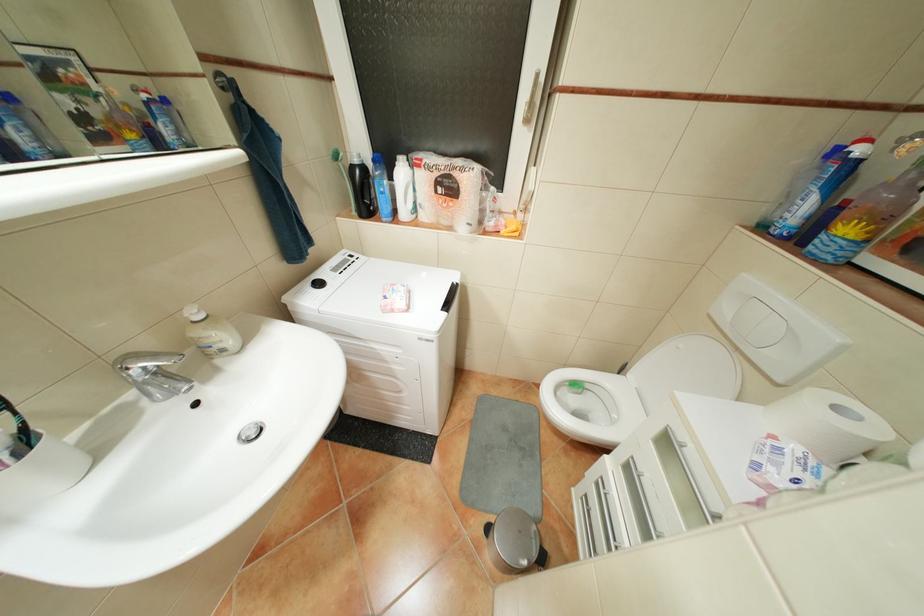
Where is `soap dispenser pump`? This screenshot has height=616, width=924. soap dispenser pump is located at coordinates (195, 310).